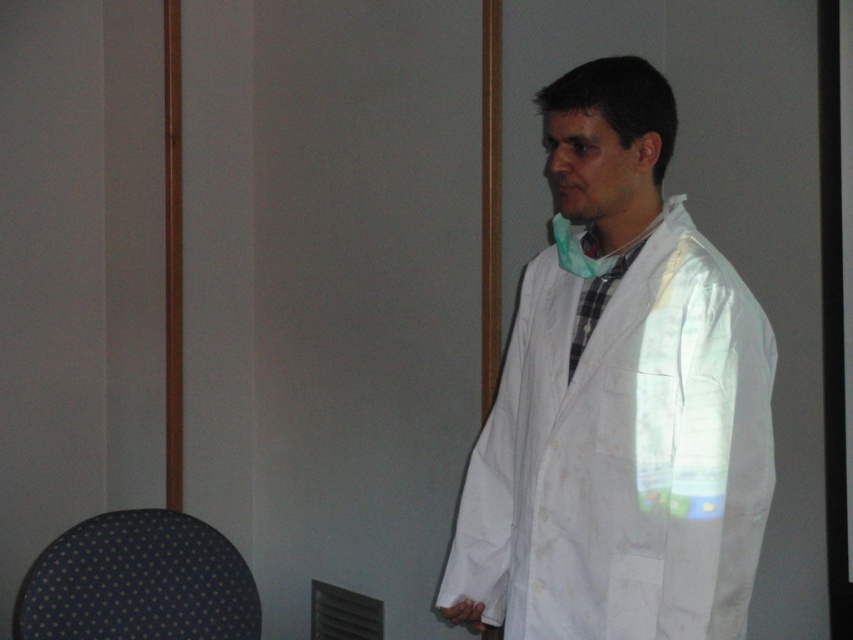
You are a researcher in a lab. You need to place a small vial of chemical solution on a specific spot. The spot is located at point (619,403). What object is at that point?

The white matte lab coat at center is located at point (619,403).

You are a visitor in a lab and need to sit down. The lab has a white matte lab coat at center and a dark blue fabric chair at lower left. Which object is closer to the entrance if the entrance is to the left of the frame?

The dark blue fabric chair at lower left is closer to the entrance because it is positioned to the left of the white matte lab coat at center, and the entrance is also on the left side of the frame.

You are a photographer setting up a shoot in this room. You want to place a small tripod between the white matte lab coat at center and the dark blue fabric chair at lower left. Can you position it so that the tripod is entirely in front of both objects?

The white matte lab coat at center is closer to the viewer than the dark blue fabric chair at lower left. Therefore, placing the tripod entirely in front of both would require positioning it closer to the lab coat, but since the chair is further back, the tripod cannot be entirely in front of both simultaneously.